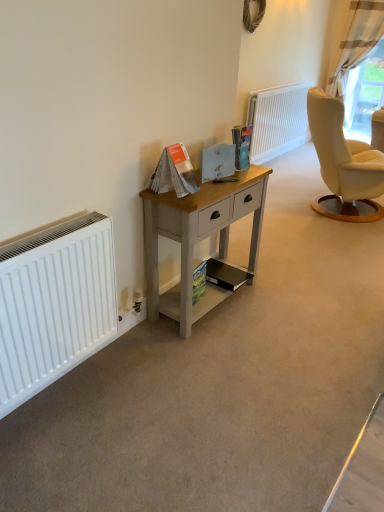
This screenshot has width=384, height=512. In order to click on empty space that is ontop of white matte radiator at lower left, which is counted as the 2th radiator, starting from the right (from a real-world perspective) in this screenshot , I will do `click(45, 228)`.